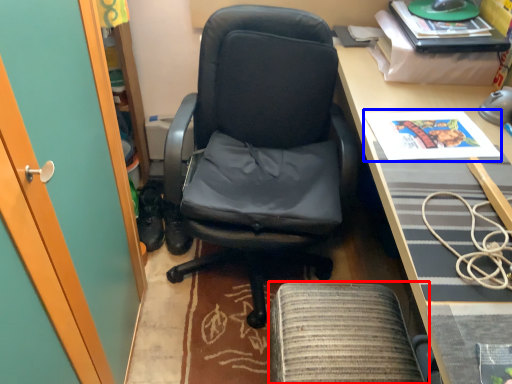
Question: Which object is closer to the camera taking this photo, footrest (highlighted by a red box) or magazine (highlighted by a blue box)?

Choices:
 (A) footrest
 (B) magazine

Answer: (A)